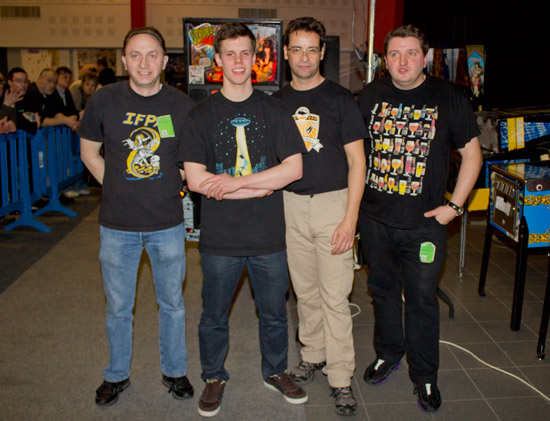
Locate an element on the screen. The image size is (550, 421). pinball machine is located at coordinates (533, 220), (194, 55), (478, 83).